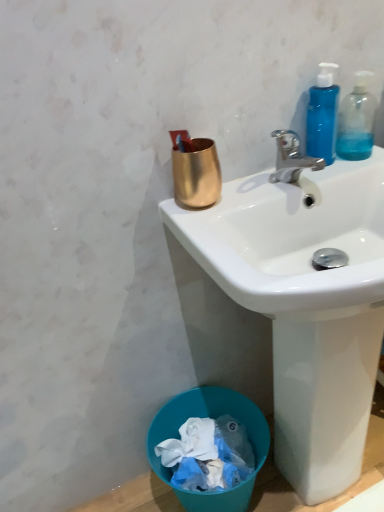
Question: Can you confirm if white glossy sink at upper center is taller than transparent plastic bottle at upper right, the 2th bottle viewed from the left?

Choices:
 (A) no
 (B) yes

Answer: (B)

Question: From the image's perspective, is white glossy sink at upper center over transparent plastic bottle at upper right, the 2th bottle viewed from the left?

Choices:
 (A) yes
 (B) no

Answer: (B)

Question: Is white glossy sink at upper center bigger than transparent plastic bottle at upper right, the 2th bottle viewed from the left?

Choices:
 (A) yes
 (B) no

Answer: (A)

Question: From a real-world perspective, is white glossy sink at upper center below transparent plastic bottle at upper right, placed as the 1th bottle when sorted from right to left?

Choices:
 (A) yes
 (B) no

Answer: (A)

Question: Would you say transparent plastic bottle at upper right, the 2th bottle viewed from the left, is part of white glossy sink at upper center's contents?

Choices:
 (A) no
 (B) yes

Answer: (A)

Question: Considering the relative positions of white glossy sink at upper center and transparent plastic bottle at upper right, the 2th bottle viewed from the left, in the image provided, is white glossy sink at upper center to the right of transparent plastic bottle at upper right, the 2th bottle viewed from the left, from the viewer's perspective?

Choices:
 (A) no
 (B) yes

Answer: (A)

Question: Would you consider blue translucent bottle at upper right, the 2th bottle viewed from the right, to be distant from polished chrome faucet at upper right?

Choices:
 (A) no
 (B) yes

Answer: (A)

Question: Is blue translucent bottle at upper right, which is the first bottle in left-to-right order, shorter than polished chrome faucet at upper right?

Choices:
 (A) yes
 (B) no

Answer: (B)

Question: Is the surface of blue translucent bottle at upper right, the 2th bottle viewed from the right, in direct contact with polished chrome faucet at upper right?

Choices:
 (A) yes
 (B) no

Answer: (A)

Question: Does blue translucent bottle at upper right, the 2th bottle viewed from the right, have a greater height compared to polished chrome faucet at upper right?

Choices:
 (A) yes
 (B) no

Answer: (A)

Question: Is polished chrome faucet at upper right surrounded by blue translucent bottle at upper right, which is the first bottle in left-to-right order?

Choices:
 (A) yes
 (B) no

Answer: (B)

Question: Is blue translucent bottle at upper right, which is the first bottle in left-to-right order, not within polished chrome faucet at upper right?

Choices:
 (A) no
 (B) yes

Answer: (B)

Question: From a real-world perspective, is blue translucent bottle at upper right, which is the first bottle in left-to-right order, below gold metallic cup at upper center?

Choices:
 (A) yes
 (B) no

Answer: (B)